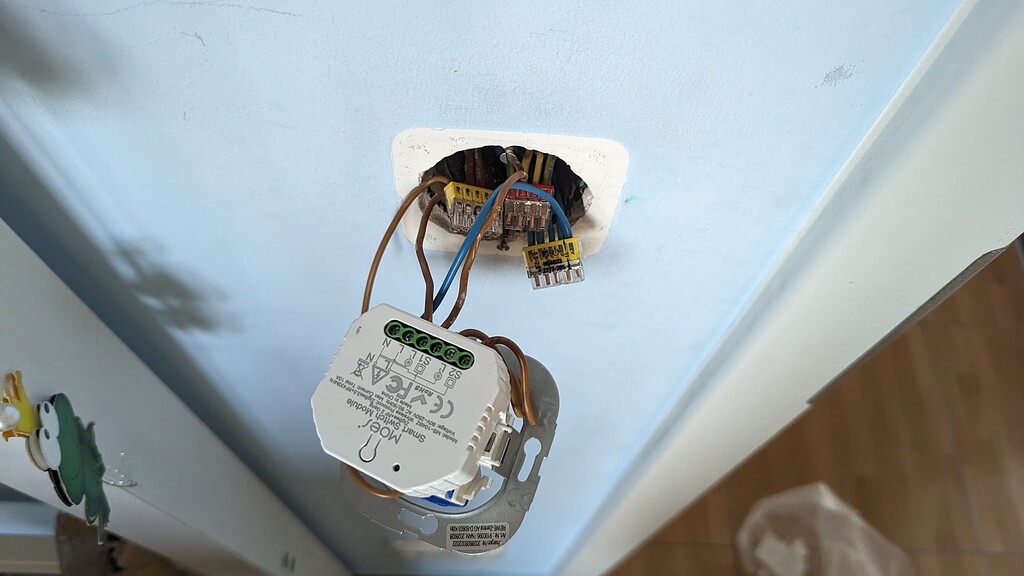
The width and height of the screenshot is (1024, 576). In order to click on laminate in this screenshot , I will do pos(930,472).